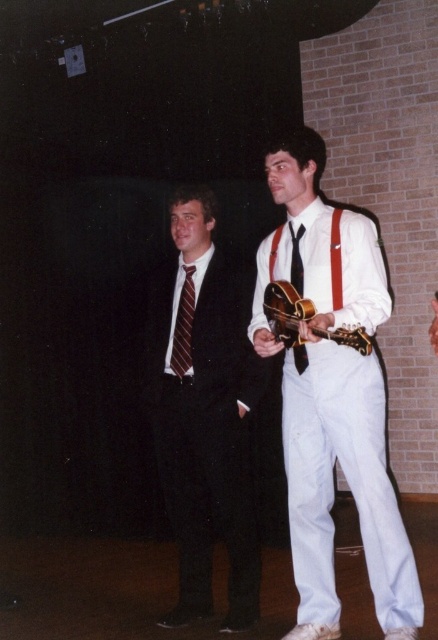
Question: Where is striped fabric tie at center located in relation to black leather belt at center in the image?

Choices:
 (A) right
 (B) left

Answer: (A)

Question: Does white matte shirt at center appear on the left side of black leather belt at center?

Choices:
 (A) yes
 (B) no

Answer: (B)

Question: Does white matte shirt at center appear under black leather belt at center?

Choices:
 (A) no
 (B) yes

Answer: (B)

Question: Among these points, which one is farthest from the camera?

Choices:
 (A) (175, 339)
 (B) (244, 579)

Answer: (A)

Question: Which of these objects is positioned closest to the black leather belt at center?

Choices:
 (A) matte black suit at center
 (B) black striped tie at center
 (C) glossy wood guitar at center
 (D) white matte shirt at center

Answer: (A)

Question: Which object is positioned farthest from the matte black suit at center?

Choices:
 (A) white matte shirt at center
 (B) striped fabric tie at center

Answer: (A)